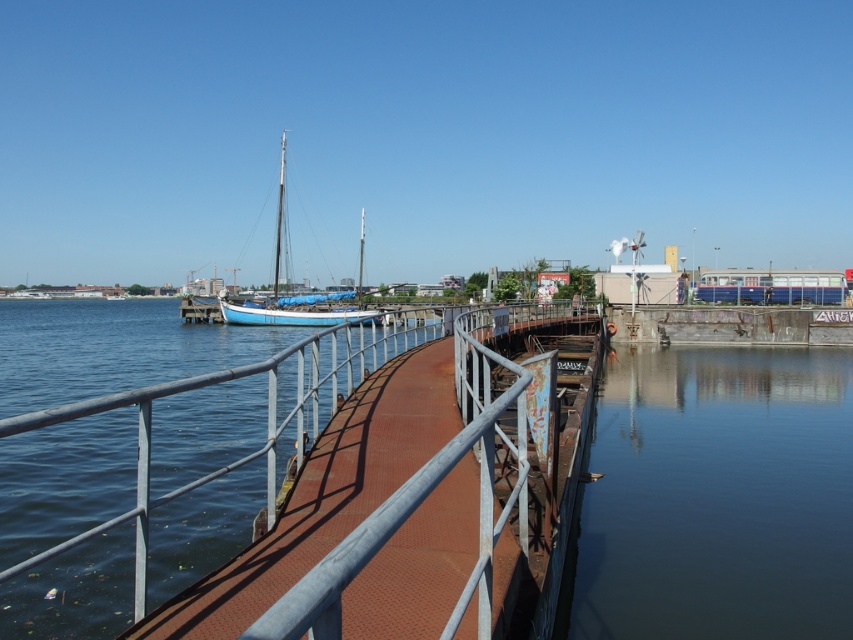
Question: Which of the following is the farthest from the observer?

Choices:
 (A) rusty metal rail at center
 (B) blue matte sailboat at center

Answer: (B)

Question: Can you confirm if rusty metal rail at center is smaller than blue matte sailboat at center?

Choices:
 (A) yes
 (B) no

Answer: (A)

Question: Which of these objects is positioned farthest from the rusty metal rail at center?

Choices:
 (A) blue matte sailboat at center
 (B) dark blue water at lower right

Answer: (A)

Question: Where is dark blue water at lower right located in relation to rusty metal rail at center in the image?

Choices:
 (A) left
 (B) right

Answer: (B)

Question: Observing the image, what is the correct spatial positioning of dark blue water at lower right in reference to blue matte sailboat at center?

Choices:
 (A) above
 (B) below

Answer: (B)

Question: Which point is closer to the camera taking this photo?

Choices:
 (A) (241, 320)
 (B) (328, 426)

Answer: (B)